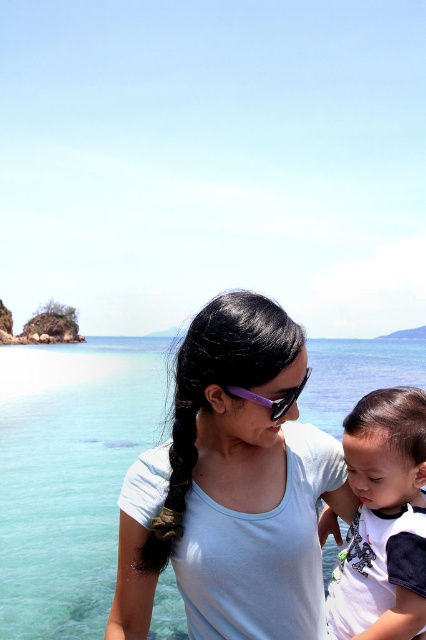
Looking at this image, you are a photographer taking a picture of the clear blue water at center and the purple plastic goggles at center. Which object appears taller in the photo?

The clear blue water at center appears taller than the purple plastic goggles at center in the photo.

You are standing at point (356, 563) and want to walk towards the woman. Is the child between you and the woman?

The distance between them is 10.79 meters, so the child is not between you and the woman.